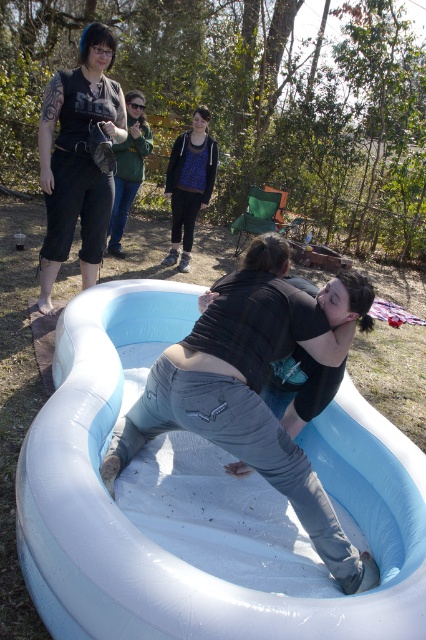
You are a photographer trying to capture a photo of the white rubber pool at center and the green fabric jacket at upper center. Which object should you focus on first if you want to ensure both are in focus without adjusting the camera settings?

The white rubber pool at center is shorter than the green fabric jacket at upper center, so you should focus on the green fabric jacket at upper center first because it is farther away. This way, the depth of field will likely include both objects when focusing on the farther one.

You are standing in the scene and want to hand a towel to the person wearing the blue printed hoodie at center. Which direction should you walk to reach them from the green fabric jacket at upper center?

The blue printed hoodie at center is to the right of the green fabric jacket at upper center, so you should walk to the right to reach them.

You are standing at the edge of the white rubber pool at center and want to hand a towel to the person wearing the blue printed hoodie at center. Which direction should you move to ensure the hoodie is visible and within reach?

Since the white rubber pool at center is in front of the blue printed hoodie at center, you should move to the side of the white rubber pool at center to ensure the hoodie is visible and within reach.